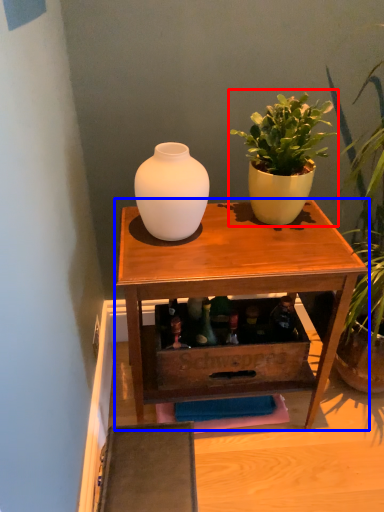
Question: Which of the following is the farthest to the observer, houseplant (highlighted by a red box) or table (highlighted by a blue box)?

Choices:
 (A) houseplant
 (B) table

Answer: (B)